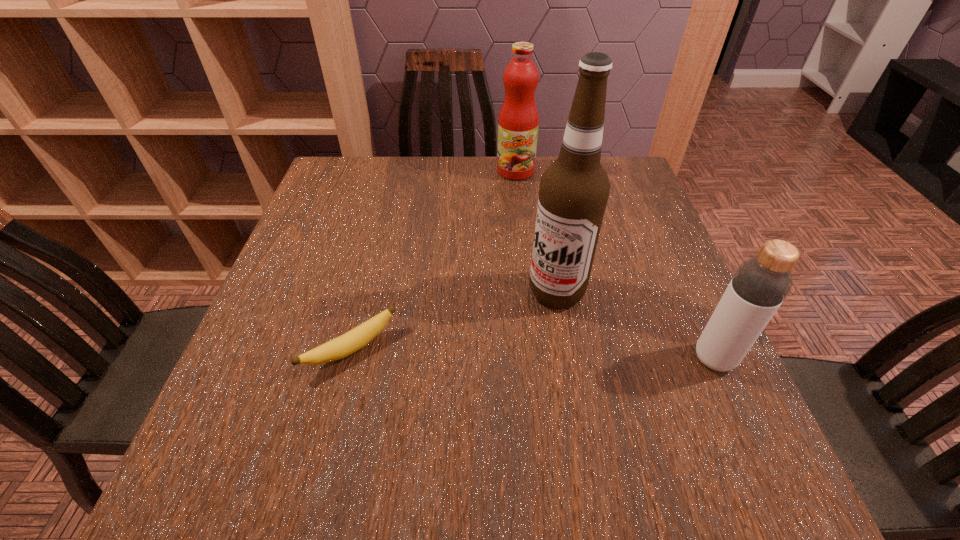
At what (x,y) coordinates should I click in order to perform the action: click on free space on the desktop that is between the leftmost object and the second shortest object and is positioned on the label of the second farthest object. Please return your answer as a coordinate pair (x, y). The width and height of the screenshot is (960, 540). Looking at the image, I should click on click(489, 353).

Identify the location of vacant spot on the desktop that is between the leftmost object and the third tallest object and is positioned on the front label of the second tallest object. (510, 354).